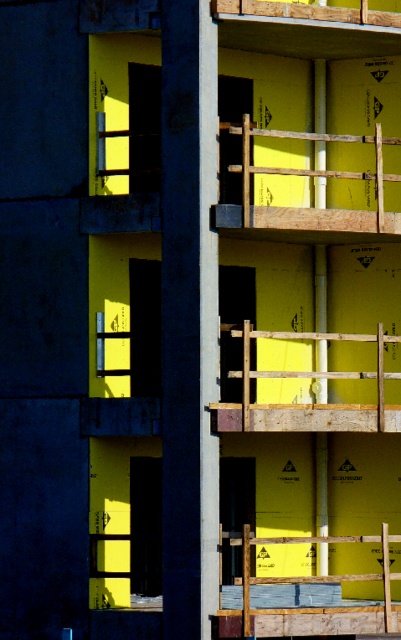
Who is more distant from viewer, [342,337] or [340,224]?

Positioned behind is point [340,224].

This screenshot has height=640, width=401. What do you see at coordinates (307, 403) in the screenshot?
I see `wooden frame at center` at bounding box center [307, 403].

Identify the location of wooden frame at center. (307, 403).

Between point (344, 422) and point (273, 620), which one is positioned in front?

Point (273, 620) is more forward.

This screenshot has width=401, height=640. What are the coordinates of `wooden frame at center` in the screenshot? It's located at click(x=307, y=403).

You are a GUI agent. You are given a task and a screenshot of the screen. Output one action in this format:
    pyautogui.click(x=<x>, y=<y>)
    Task: Click on the wooden frame at center
    The image size is (401, 640).
    Given the screenshot: What is the action you would take?
    click(x=307, y=403)

Is yellow foam insulation at center further to the viewer compared to wooden at upper center?

No, yellow foam insulation at center is closer to the viewer.

Can you confirm if yellow foam insulation at center is wider than wooden at upper center?

In fact, yellow foam insulation at center might be narrower than wooden at upper center.

Is point (285, 620) positioned behind point (378, 227)?

No, it is not.

The image size is (401, 640). Find the location of `yellow foam insulation at center`. yellow foam insulation at center is located at coordinates (309, 608).